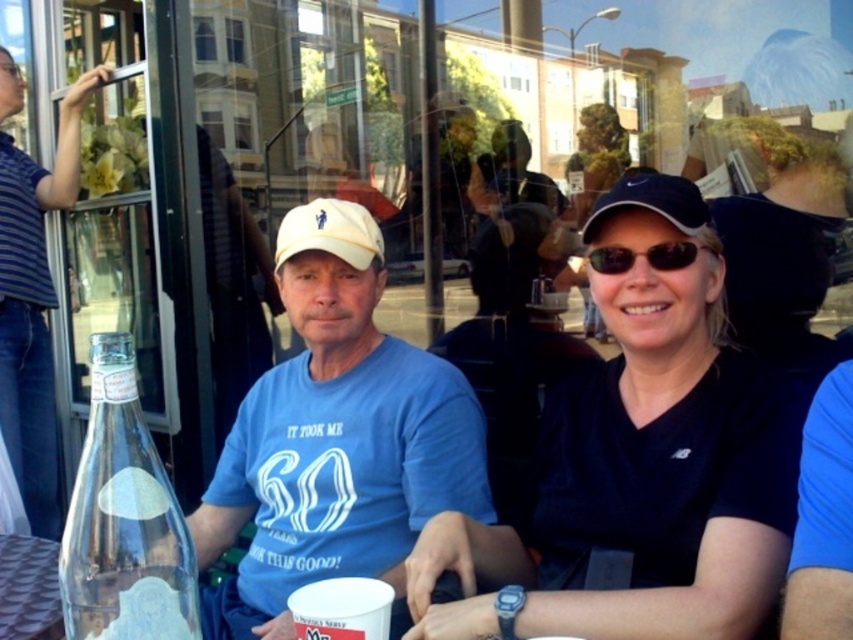
Can you confirm if matte blue t-shirt at center is bigger than clear glass bottle at left?

Indeed, matte blue t-shirt at center has a larger size compared to clear glass bottle at left.

Who is higher up, matte blue t-shirt at center or clear glass bottle at left?

clear glass bottle at left is higher up.

Is point (207, 637) positioned in front of point (132, 483)?

No.

What are the coordinates of `matte blue t-shirt at center` in the screenshot? It's located at (335, 438).

Can you confirm if black matte baseball cap at upper right is shorter than blue matte baseball cap at upper right?

Incorrect, black matte baseball cap at upper right's height does not fall short of blue matte baseball cap at upper right's.

Can you confirm if black matte baseball cap at upper right is thinner than blue matte baseball cap at upper right?

No, black matte baseball cap at upper right is not thinner than blue matte baseball cap at upper right.

Identify the location of black matte baseball cap at upper right. (639, 483).

Which of these two, blue striped shirt at left or sunglasses at center, stands shorter?

sunglasses at center

Does point (62, 138) come in front of point (589, 252)?

That is False.

Where is `blue striped shirt at left`? blue striped shirt at left is located at coordinates (33, 305).